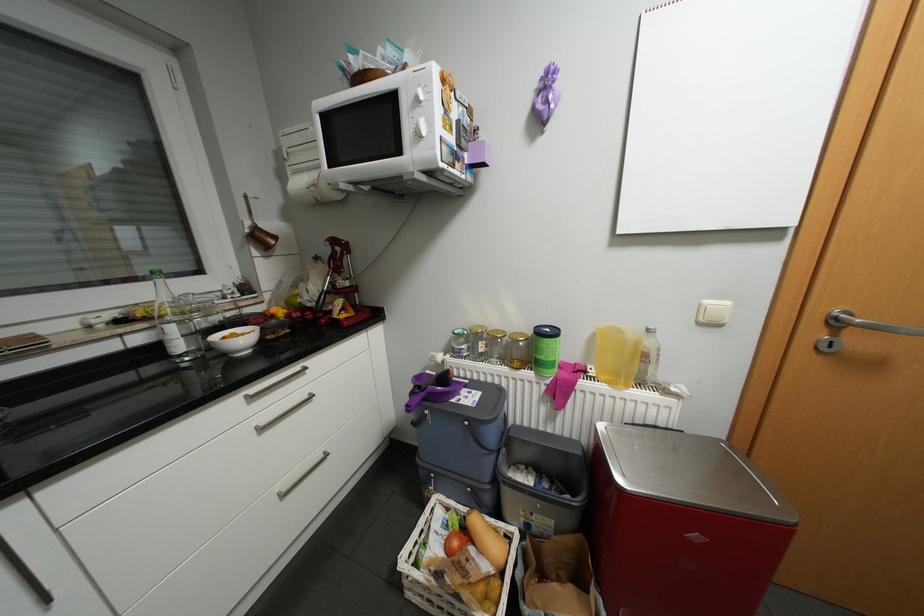
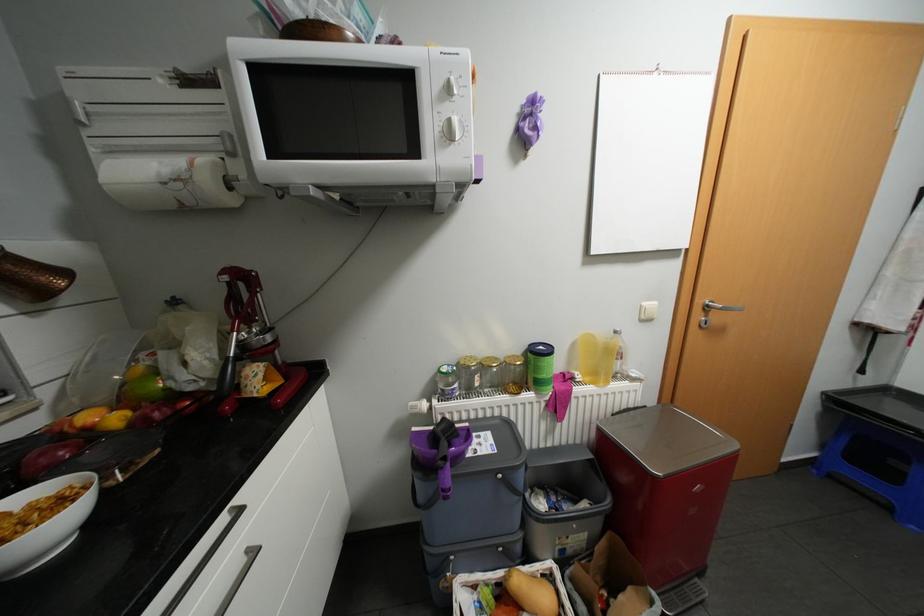
In the second image, find the point that corresponds to (288,312) in the first image.

(123, 418)